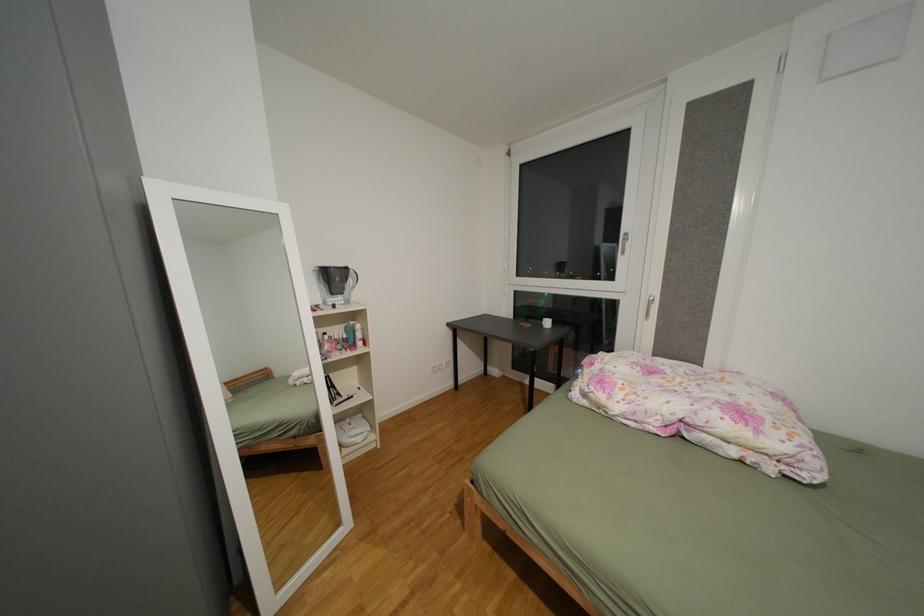
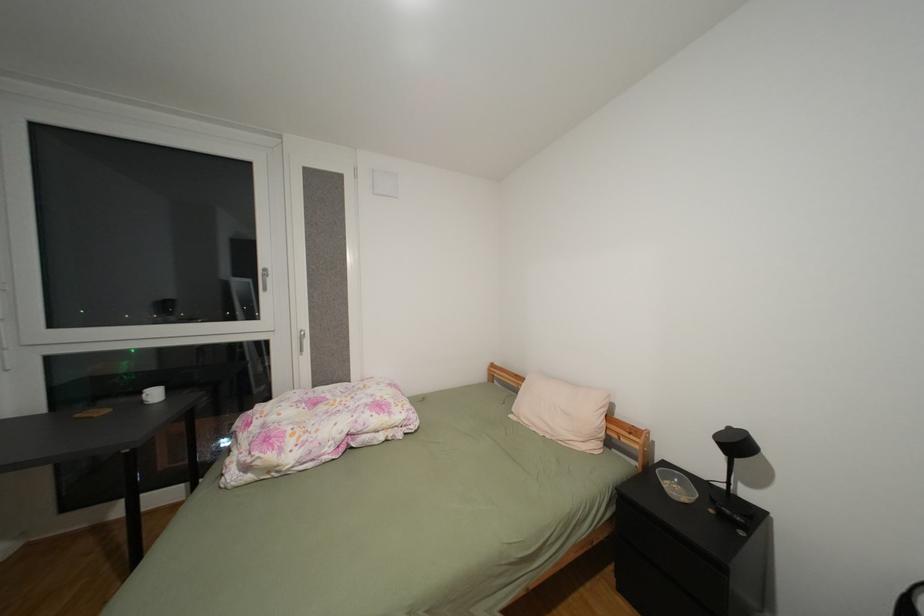
Question: Based on the continuous images, in which direction is the camera rotating? Reply with the corresponding letter.

Choices:
 (A) Left
 (B) Right
 (C) Up
 (D) Down

Answer: (B)